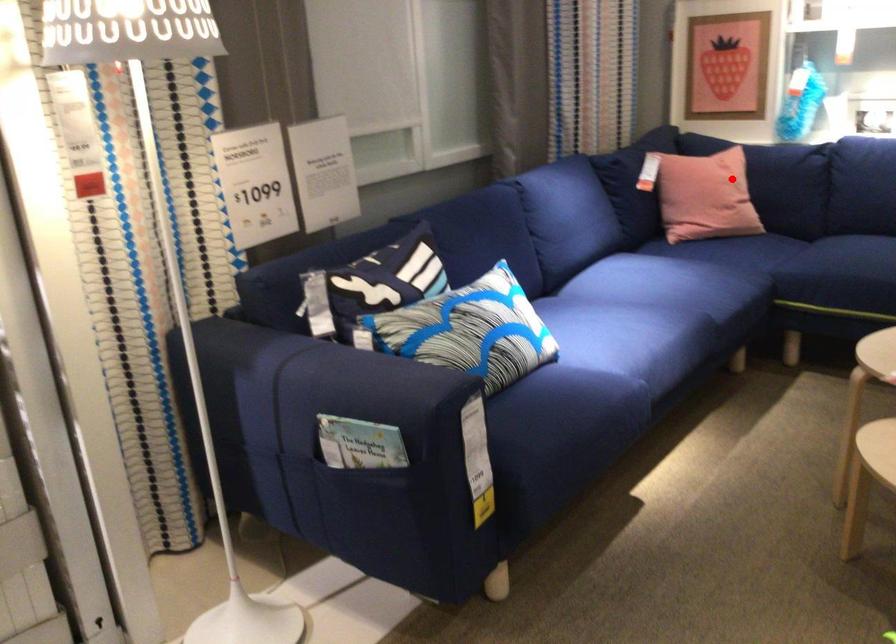
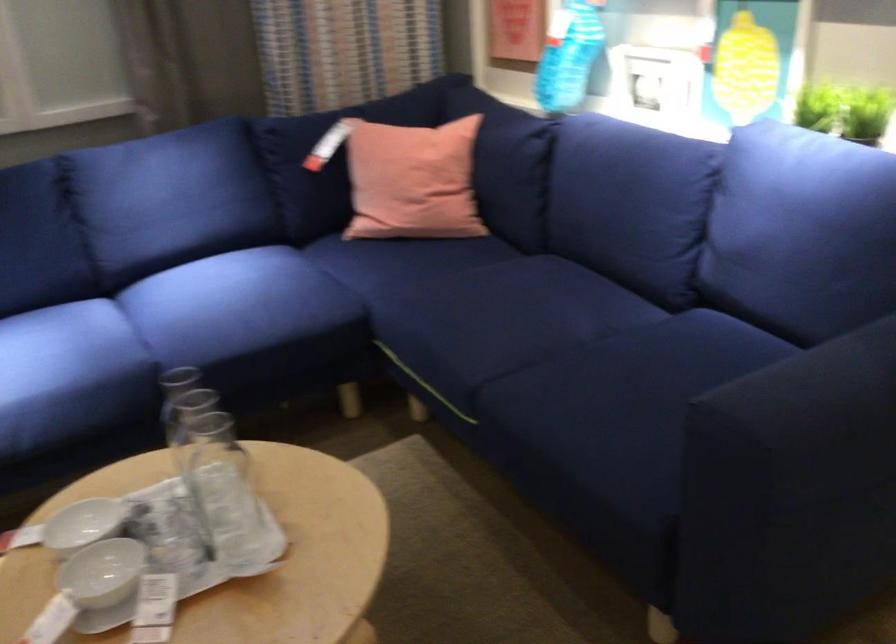
In the second image, find the point that corresponds to the highlighted location in the first image.

(412, 181)